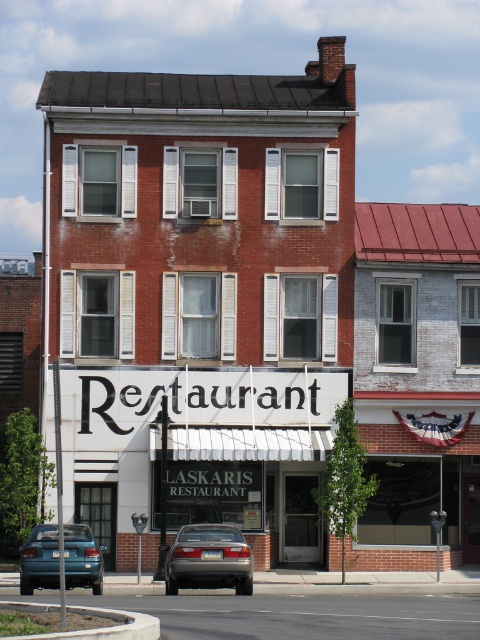
Does point (233, 584) lie behind point (72, 579)?

Yes.

Is point (238, 556) in front of point (67, 557)?

No, it is behind (67, 557).

Where is `satin silver sedan at center`? Image resolution: width=480 pixels, height=640 pixels. satin silver sedan at center is located at coordinates (208, 560).

Locate an element on the screen. The image size is (480, 640). satin silver sedan at center is located at coordinates (208, 560).